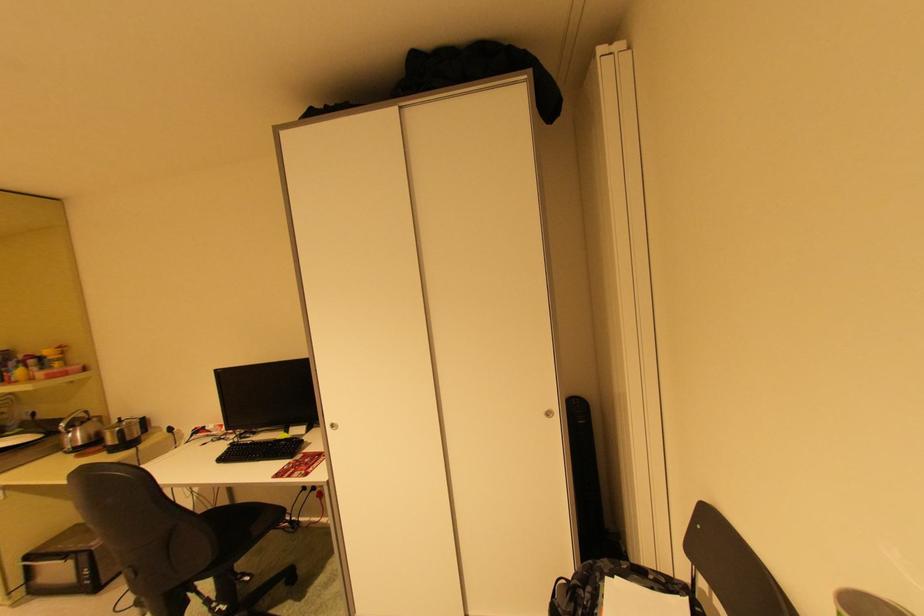
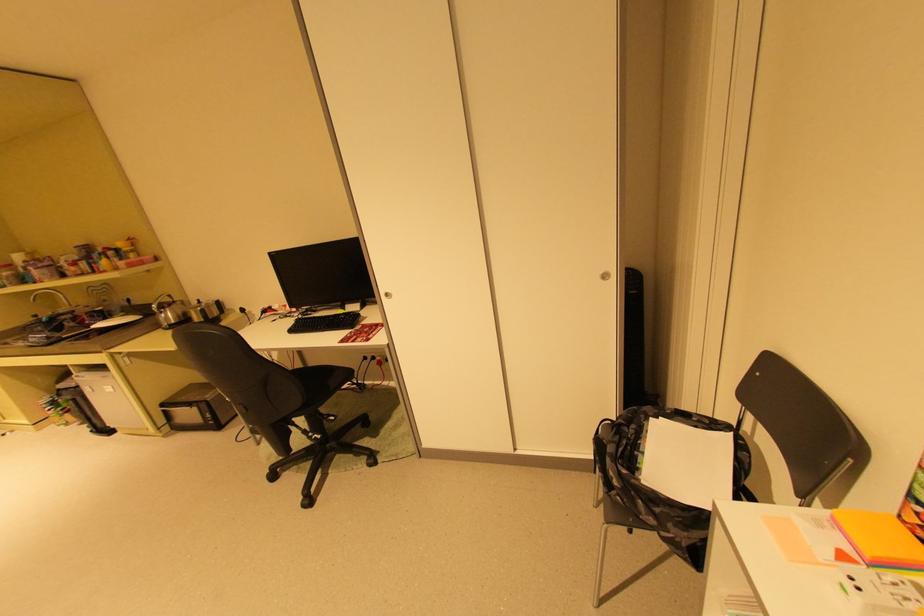
Question: The images are taken continuously from a first-person perspective. In which direction is your viewpoint rotating?

Choices:
 (A) Left
 (B) Right
 (C) Up
 (D) Down

Answer: (D)